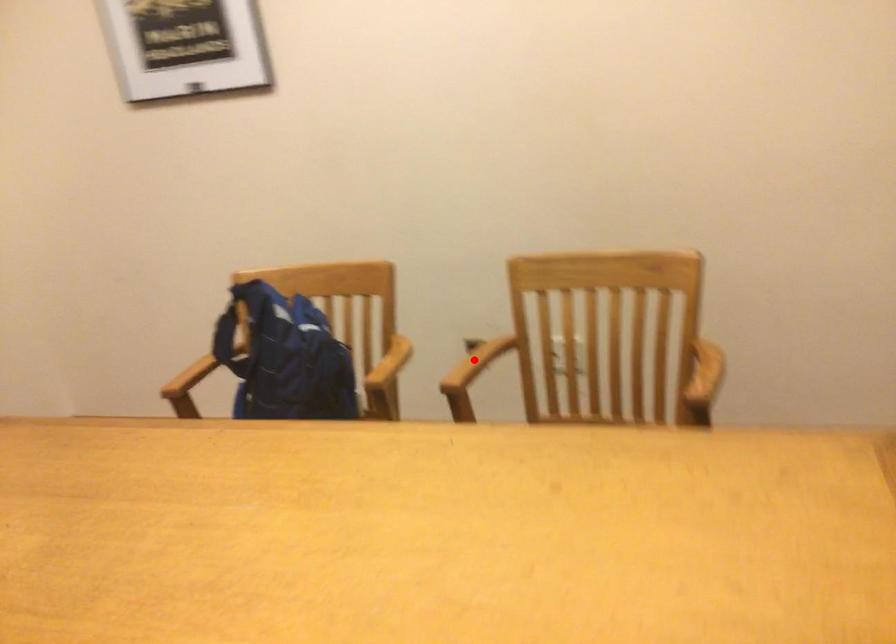
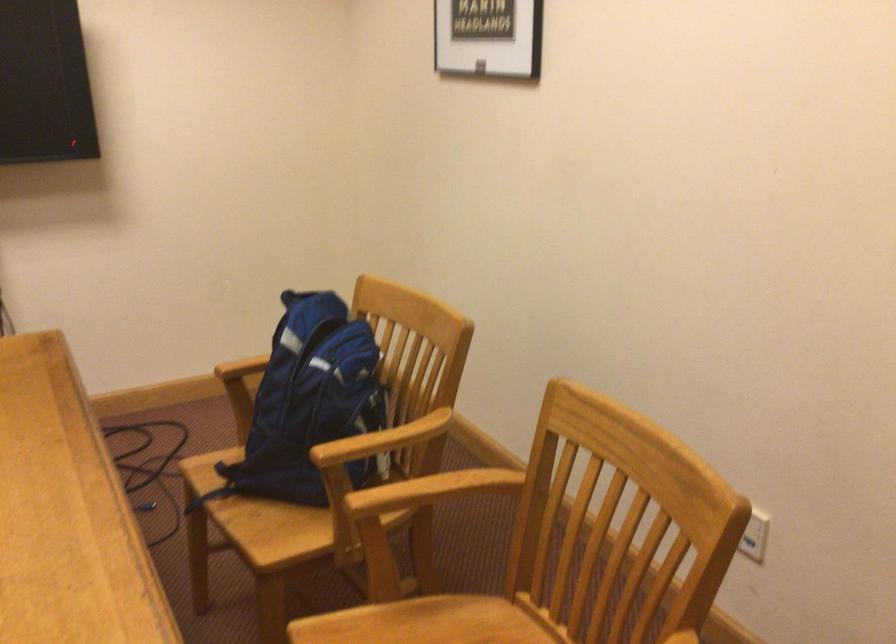
Question: I am providing you with two images of the same scene from different viewpoints. A red point is shown in image1. For the corresponding object point in image2, is it positioned nearer or farther from the camera?

Choices:
 (A) Nearer
 (B) Farther

Answer: (A)